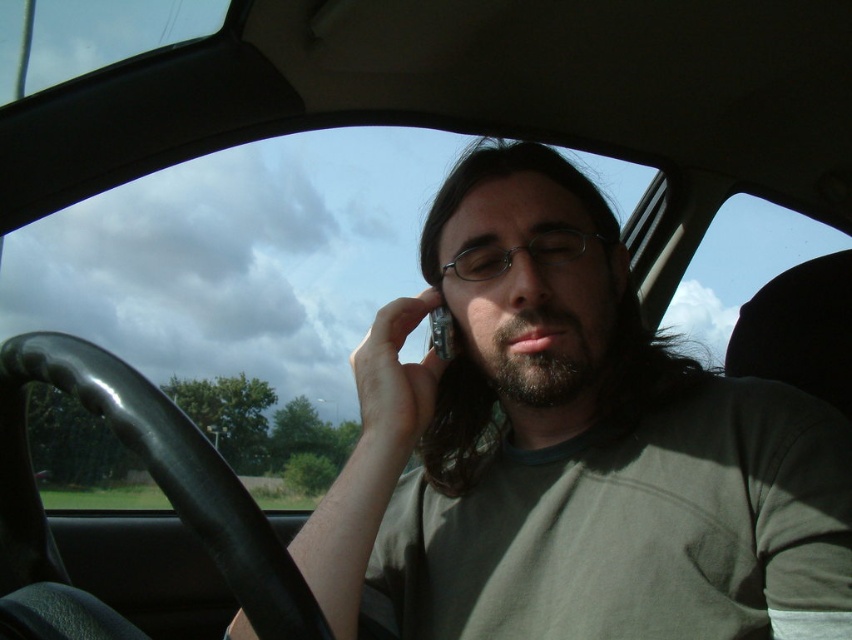
Can you confirm if transparent glass car window at upper center is positioned below matte black phone at center?

Indeed, transparent glass car window at upper center is positioned under matte black phone at center.

Is transparent glass car window at upper center wider than matte black phone at center?

Yes, transparent glass car window at upper center is wider than matte black phone at center.

The image size is (852, 640). Identify the location of transparent glass car window at upper center. (242, 285).